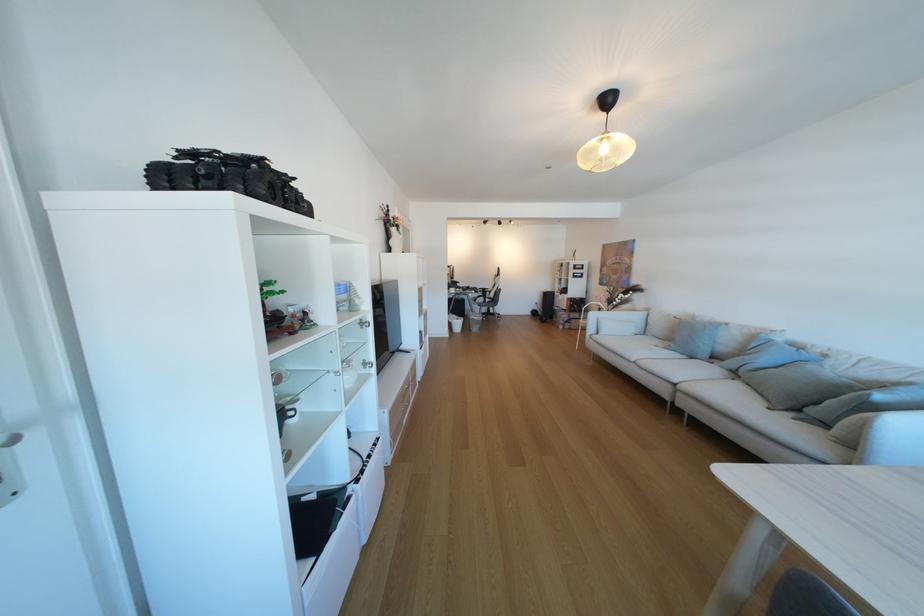
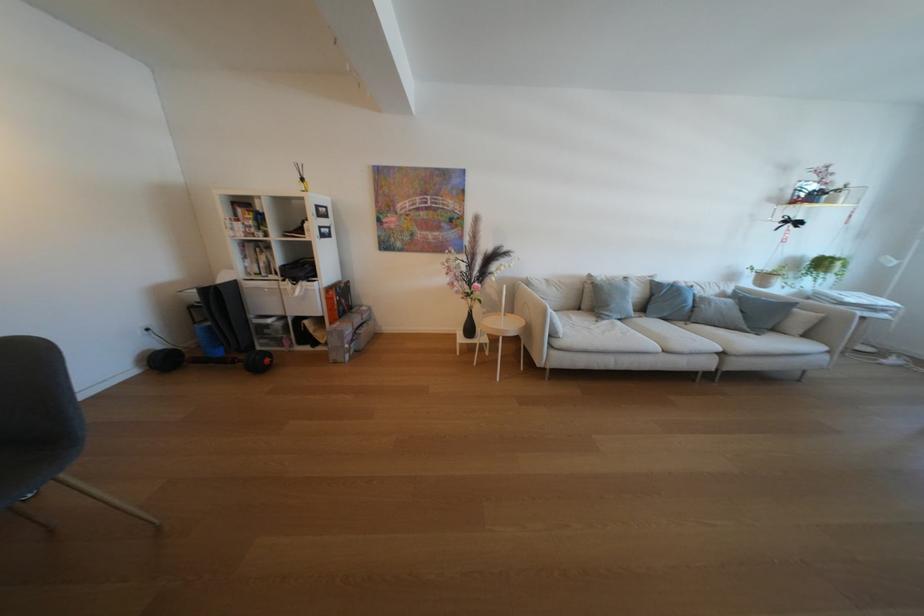
In the second image, find the point that corresponds to (x=718, y=321) in the first image.

(614, 278)